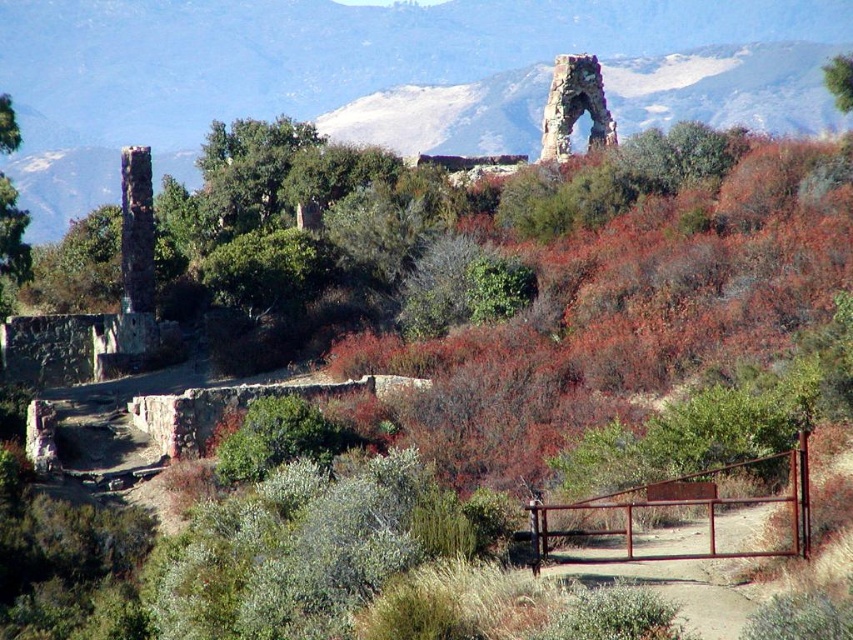
Consider the image. You are standing at the rustic metal gate in the foreground of the scene. You see two points marked in the image. Which point is closer to you, point at coordinate (535, 528) or point at coordinate (544, 156)?

Point at coordinate (535, 528) is closer to you than point at coordinate (544, 156).

You are standing at the point marked as point (x=679, y=506) in the image. Looking around, you see the rusty metal gate at lower right. Which direction should you walk to exit the ruins area towards the mountains in the background?

The point (x=679, y=506) is on the rusty metal gate at lower right. To exit the ruins area towards the mountains in the background, you should walk forward through the gate since the mountains are in the background behind the gate.

You are standing at the entrance of the ruins and want to take a photo of the rusty metal gate at lower right and the rusty stone arch at upper center. To ensure both are in frame, should you zoom in or zoom out?

You should zoom out to include both the rusty metal gate at lower right and the rusty stone arch at upper center in the frame since the rusty metal gate at lower right is below the rusty stone arch at upper center.